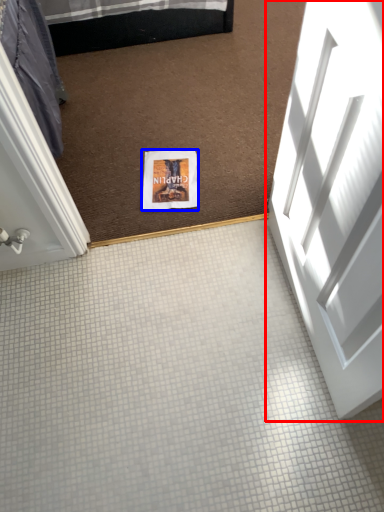
Question: Among these objects, which one is farthest to the camera, door (highlighted by a red box) or flyer (highlighted by a blue box)?

Choices:
 (A) door
 (B) flyer

Answer: (B)